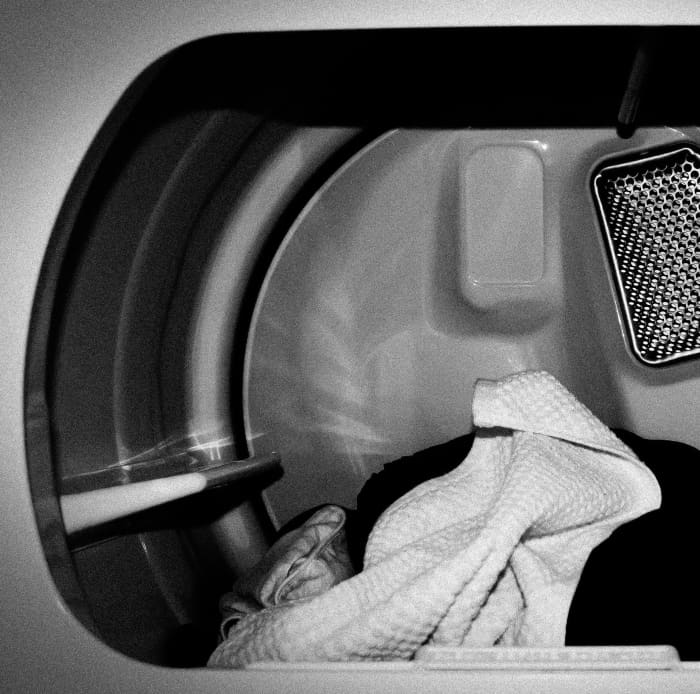
Locate an element on the screen. towel or blanket is located at coordinates (316, 539).